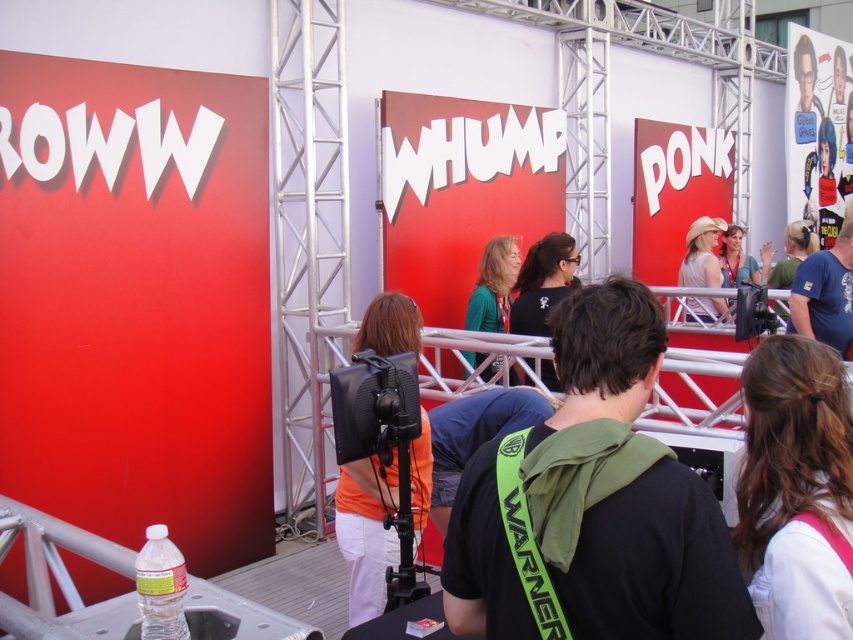
Looking at this image, does white fabric at upper right have a greater width compared to blue t-shirt at upper right?

No.

Image resolution: width=853 pixels, height=640 pixels. I want to click on white fabric at upper right, so click(x=795, y=488).

Does point (808, 465) come farther from viewer compared to point (413, 365)?

No, (808, 465) is in front of (413, 365).

You are a GUI agent. You are given a task and a screenshot of the screen. Output one action in this format:
    pyautogui.click(x=<x>, y=<y>)
    Task: Click on the white fabric at upper right
    
    Given the screenshot: What is the action you would take?
    pyautogui.click(x=795, y=488)

Does point (828, 464) come in front of point (416, 444)?

Yes.

Locate an element on the screen. white fabric at upper right is located at coordinates (795, 488).

Is green fabric shirt at upper right shorter than matte black camera at upper right?

Indeed, green fabric shirt at upper right has a lesser height compared to matte black camera at upper right.

Does point (807, 244) lie behind point (724, 268)?

Yes, it is.

The height and width of the screenshot is (640, 853). Find the location of `green fabric shirt at upper right`. green fabric shirt at upper right is located at coordinates (788, 253).

The image size is (853, 640). What are the coordinates of `green fabric shirt at upper right` in the screenshot? It's located at (788, 253).